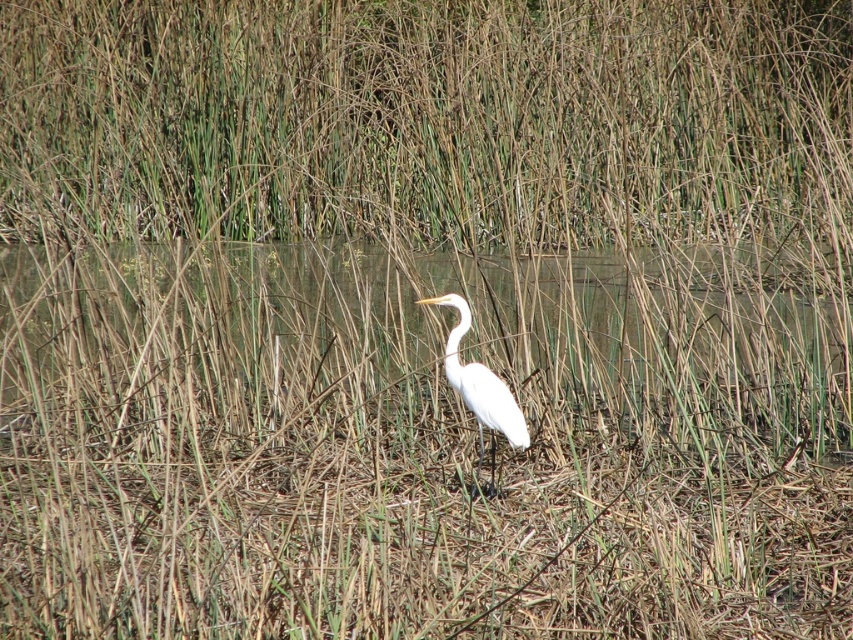
You are a photographer trying to capture the white smooth heron at center in the wetland scene. Since the clear water at center is in the way, will you need to adjust your camera angle to focus on the heron?

The clear water at center is taller than the white smooth heron at center, so you will need to adjust your camera angle to focus on the heron as the water is obstructing the view.

You are a photographer wanting to capture the white smooth heron at center in your shot. The clear water at center reflects the heron. How does the size of the heron in the reflection compare to the actual heron?

The clear water at center has a larger size compared to the white smooth heron at center, so the reflection of the white smooth heron at center would appear larger than the actual heron.